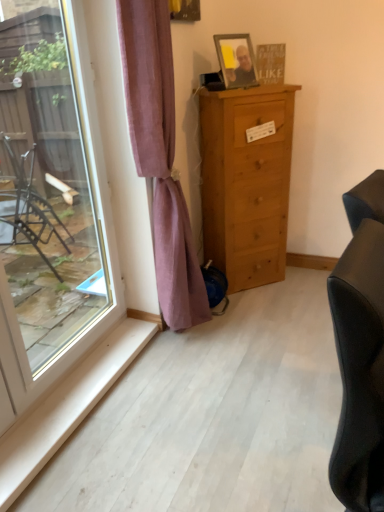
Question: Is transparent glass window at left smaller than wooden framed photo at upper center?

Choices:
 (A) no
 (B) yes

Answer: (A)

Question: Considering the relative sizes of transparent glass window at left and wooden framed photo at upper center in the image provided, is transparent glass window at left thinner than wooden framed photo at upper center?

Choices:
 (A) no
 (B) yes

Answer: (B)

Question: From the image's perspective, is transparent glass window at left above wooden framed photo at upper center?

Choices:
 (A) no
 (B) yes

Answer: (A)

Question: Is wooden framed photo at upper center completely or partially inside transparent glass window at left?

Choices:
 (A) yes
 (B) no

Answer: (B)

Question: Is transparent glass window at left not within wooden framed photo at upper center?

Choices:
 (A) no
 (B) yes

Answer: (B)

Question: Is transparent glass window at left in front of wooden framed photo at upper center?

Choices:
 (A) yes
 (B) no

Answer: (A)

Question: Is light brown wood chest of drawers at center directly adjacent to purple velvet curtain at center?

Choices:
 (A) yes
 (B) no

Answer: (B)

Question: Is purple velvet curtain at center at the back of light brown wood chest of drawers at center?

Choices:
 (A) yes
 (B) no

Answer: (B)

Question: From the image's perspective, is light brown wood chest of drawers at center under purple velvet curtain at center?

Choices:
 (A) no
 (B) yes

Answer: (A)

Question: Considering the relative sizes of light brown wood chest of drawers at center and purple velvet curtain at center in the image provided, is light brown wood chest of drawers at center shorter than purple velvet curtain at center?

Choices:
 (A) yes
 (B) no

Answer: (A)

Question: Are light brown wood chest of drawers at center and purple velvet curtain at center far apart?

Choices:
 (A) yes
 (B) no

Answer: (B)

Question: From a real-world perspective, is light brown wood chest of drawers at center below purple velvet curtain at center?

Choices:
 (A) no
 (B) yes

Answer: (B)

Question: From the image's perspective, is purple velvet curtain at center on top of transparent glass window at left?

Choices:
 (A) no
 (B) yes

Answer: (B)